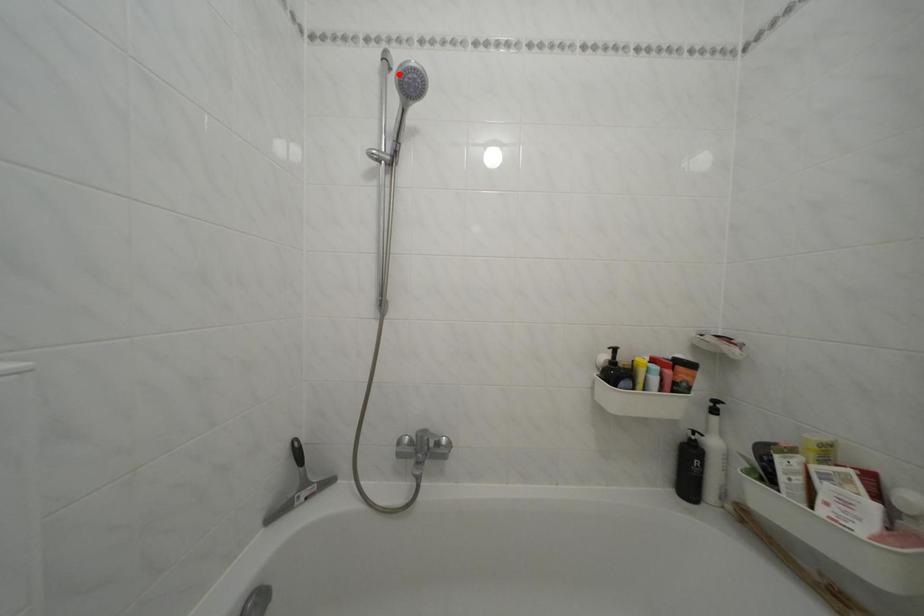
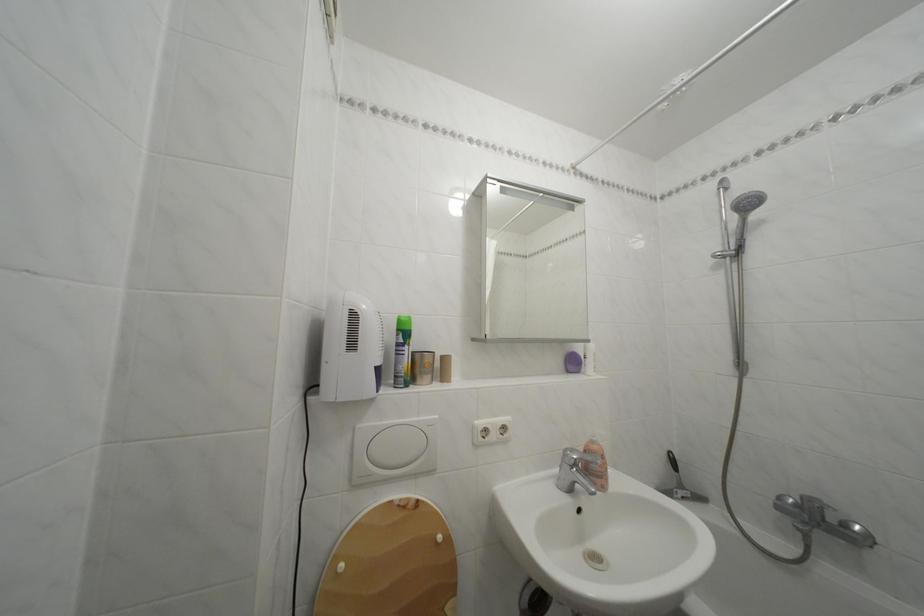
Question: I am providing you with two images of the same scene from different viewpoints. Image1 has a red point marked. In image2, the corresponding 3D location appears at what relative position? Reply with the corresponding letter.

Choices:
 (A) Closer
 (B) Farther

Answer: (B)